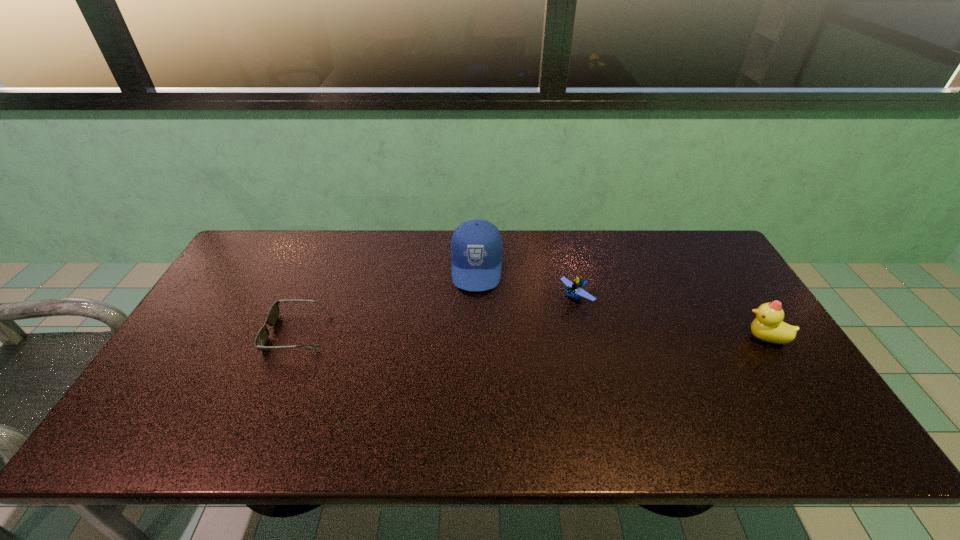
Locate an element on the screen. This screenshot has width=960, height=540. free space at the far edge of the desktop is located at coordinates (420, 250).

This screenshot has height=540, width=960. I want to click on free space at the near edge of the desktop, so click(x=347, y=397).

Find the location of a particular element. The height and width of the screenshot is (540, 960). blank area at the left edge is located at coordinates (226, 282).

I want to click on vacant space at the right edge of the desktop, so click(748, 322).

Identify the location of free spot at the far right corner of the desktop. This screenshot has width=960, height=540. (681, 251).

I want to click on vacant space at the near right corner, so click(773, 392).

Locate an element on the screen. Image resolution: width=960 pixels, height=540 pixels. vacant region between the sunglasses and the rightmost object is located at coordinates (532, 335).

Locate an element on the screen. Image resolution: width=960 pixels, height=540 pixels. vacant area that lies between the second object from right to left and the sunglasses is located at coordinates (437, 315).

You are a GUI agent. You are given a task and a screenshot of the screen. Output one action in this format:
    pyautogui.click(x=<x>, y=<y>)
    Task: Click on the free space between the duckling and the third tallest object
    This screenshot has width=960, height=540.
    Given the screenshot: What is the action you would take?
    pyautogui.click(x=671, y=318)

Identify the location of vacant area that lies between the second object from left to right and the duckling. (621, 303).